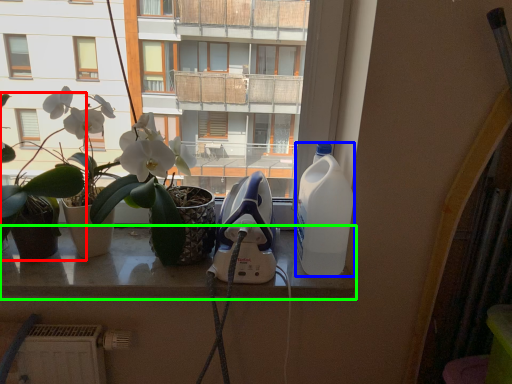
Question: Which object is positioned closest to houseplant (highlighted by a red box)? Select from bottle (highlighted by a blue box) and window (highlighted by a green box).

Choices:
 (A) bottle
 (B) window

Answer: (B)